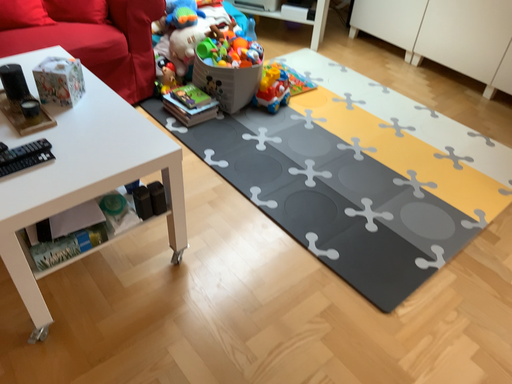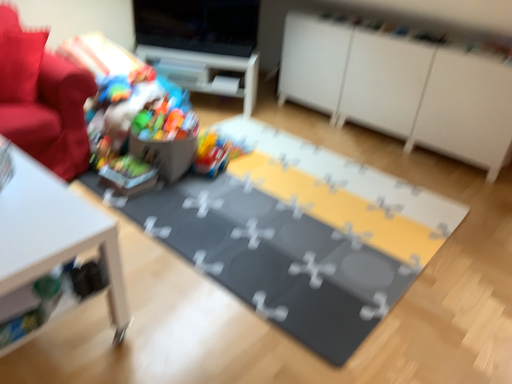
Question: How did the camera likely rotate when shooting the video?

Choices:
 (A) rotated downward
 (B) rotated upward

Answer: (B)